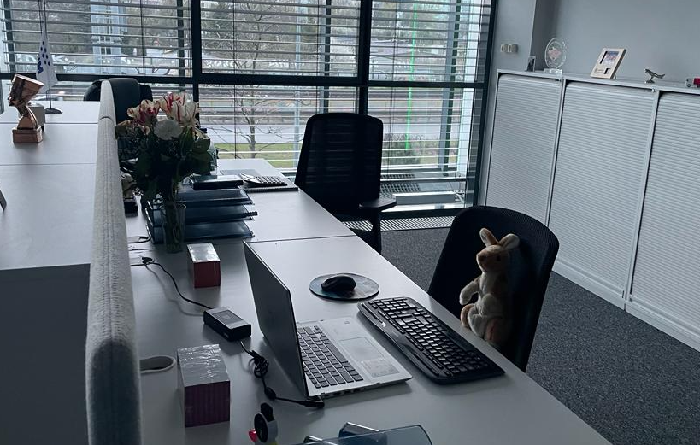
I want to click on 1 mousepad, so click(x=365, y=293).